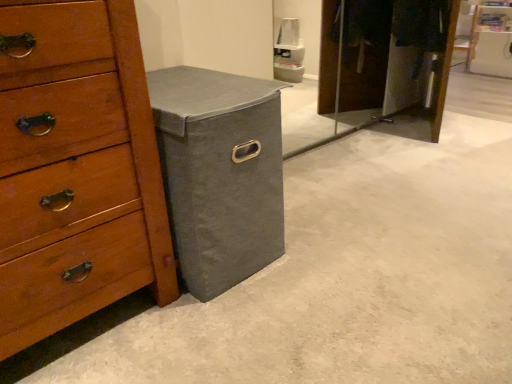
Question: From a real-world perspective, is gray fabric storage bin at lower left under wooden chest of drawers at left?

Choices:
 (A) no
 (B) yes

Answer: (B)

Question: Does gray fabric storage bin at lower left have a lesser height compared to wooden chest of drawers at left?

Choices:
 (A) yes
 (B) no

Answer: (A)

Question: From the image's perspective, is gray fabric storage bin at lower left located beneath wooden chest of drawers at left?

Choices:
 (A) yes
 (B) no

Answer: (B)

Question: Could wooden chest of drawers at left be considered to be inside gray fabric storage bin at lower left?

Choices:
 (A) no
 (B) yes

Answer: (A)

Question: Is gray fabric storage bin at lower left beside wooden chest of drawers at left?

Choices:
 (A) yes
 (B) no

Answer: (B)

Question: Can you confirm if gray fabric storage bin at lower left is positioned to the right of wooden chest of drawers at left?

Choices:
 (A) yes
 (B) no

Answer: (A)

Question: Are wooden chest of drawers at left and gray fabric storage bin at lower left making contact?

Choices:
 (A) yes
 (B) no

Answer: (B)

Question: Could you tell me if wooden chest of drawers at left is turned towards gray fabric storage bin at lower left?

Choices:
 (A) yes
 (B) no

Answer: (B)

Question: Does wooden chest of drawers at left come in front of gray fabric storage bin at lower left?

Choices:
 (A) no
 (B) yes

Answer: (B)

Question: Is wooden chest of drawers at left not inside gray fabric storage bin at lower left?

Choices:
 (A) no
 (B) yes

Answer: (B)

Question: From the image's perspective, is wooden chest of drawers at left under gray fabric storage bin at lower left?

Choices:
 (A) yes
 (B) no

Answer: (A)

Question: From a real-world perspective, is wooden chest of drawers at left positioned under gray fabric storage bin at lower left based on gravity?

Choices:
 (A) yes
 (B) no

Answer: (B)

Question: In the image, is wooden chest of drawers at left on the left side or the right side of gray fabric storage bin at lower left?

Choices:
 (A) left
 (B) right

Answer: (A)